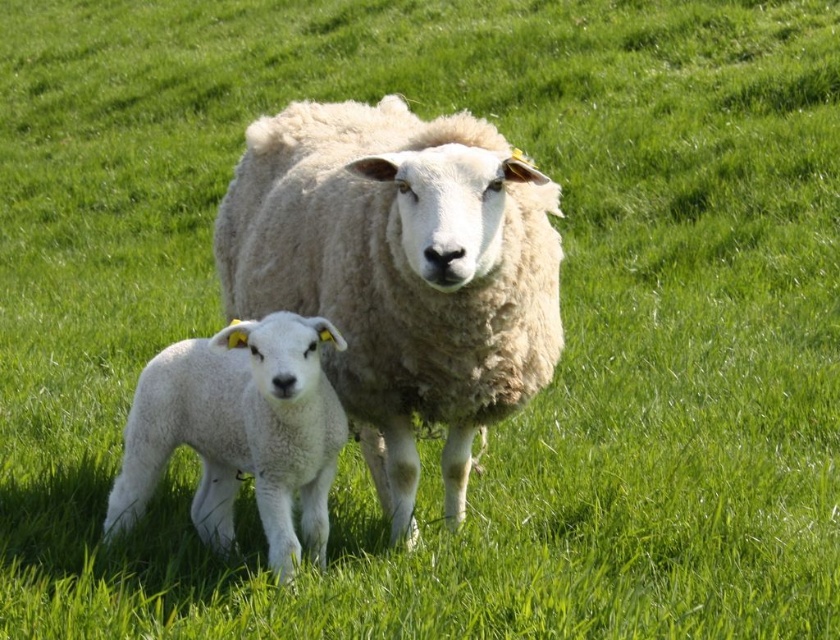
Question: Which point is closer to the camera?

Choices:
 (A) (308, 291)
 (B) (345, 433)

Answer: (B)

Question: Among these objects, which one is nearest to the camera?

Choices:
 (A) white woolen sheep at center
 (B) white woolen lamb at lower left

Answer: (A)

Question: Does white woolen sheep at center have a lesser width compared to white woolen lamb at lower left?

Choices:
 (A) yes
 (B) no

Answer: (B)

Question: Can you confirm if white woolen sheep at center is positioned above white woolen lamb at lower left?

Choices:
 (A) no
 (B) yes

Answer: (B)

Question: Does white woolen sheep at center appear on the left side of white woolen lamb at lower left?

Choices:
 (A) no
 (B) yes

Answer: (A)

Question: Which of the following is the closest to the observer?

Choices:
 (A) white woolen lamb at lower left
 (B) white woolen sheep at center

Answer: (B)